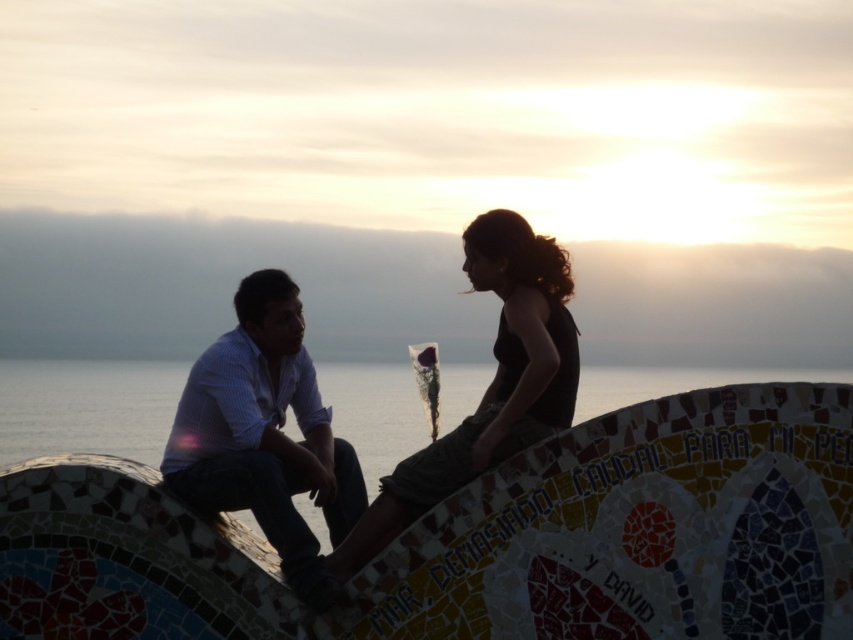
Question: Which object appears closest to the camera in this image?

Choices:
 (A) matte white shirt at left
 (B) silhouette fabric at center

Answer: (A)

Question: From the image, what is the correct spatial relationship of transparent glass water at center in relation to silhouette fabric at center?

Choices:
 (A) above
 (B) below

Answer: (B)

Question: Can you confirm if matte white shirt at left is positioned below silhouette fabric at center?

Choices:
 (A) yes
 (B) no

Answer: (A)

Question: In this image, where is transparent glass water at center located relative to silhouette fabric at center?

Choices:
 (A) left
 (B) right

Answer: (B)

Question: Which object is farther from the camera taking this photo?

Choices:
 (A) transparent glass water at center
 (B) matte white shirt at left
 (C) silhouette fabric at center

Answer: (C)

Question: Which object appears farthest from the camera in this image?

Choices:
 (A) silhouette fabric at center
 (B) matte white shirt at left
 (C) transparent glass water at center

Answer: (A)